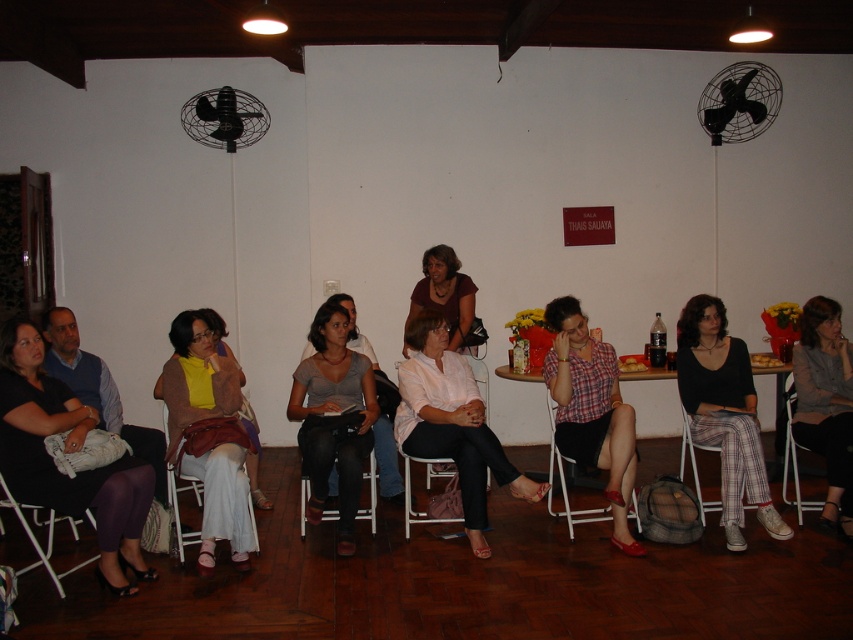
Question: Among these objects, which one is nearest to the camera?

Choices:
 (A) plastic at center
 (B) plaid cotton pants at center
 (C) matte brown blouse at center

Answer: (B)

Question: Does matte yellow scarf at center appear under gray wool sweater at center?

Choices:
 (A) yes
 (B) no

Answer: (A)

Question: Among these points, which one is farthest from the camera?

Choices:
 (A) (73, 483)
 (B) (51, 337)
 (C) (294, 372)
 (D) (230, 472)

Answer: (B)

Question: Can you confirm if black fabric chair at center is smaller than plastic at center?

Choices:
 (A) yes
 (B) no

Answer: (A)

Question: Which point appears closest to the camera in this image?

Choices:
 (A) (194, 422)
 (B) (817, 314)
 (C) (405, 392)
 (D) (61, 573)

Answer: (D)

Question: Does matte yellow scarf at center lie behind matte brown blouse at center?

Choices:
 (A) yes
 (B) no

Answer: (B)